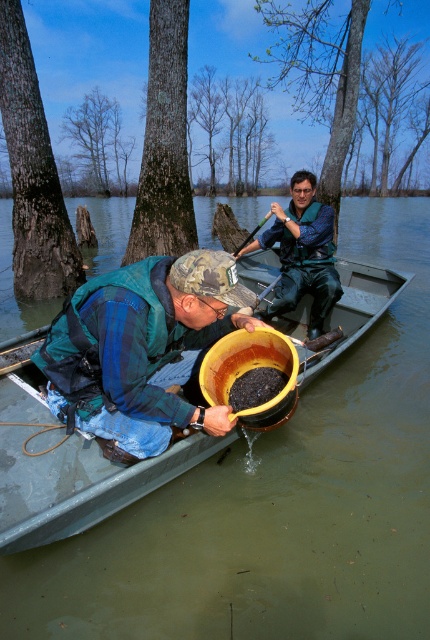
Is the position of green plastic boat at center more distant than that of blue fabric jacket at center?

No, it is not.

Identify the location of green plastic boat at center. (79, 484).

Is point (116, 504) closer to camera compared to point (307, 177)?

Yes, it is.

Identify the location of green plastic boat at center. This screenshot has height=640, width=430. (79, 484).

Does green plastic boat at center have a lesser height compared to wooden paddle at center?

Indeed, green plastic boat at center has a lesser height compared to wooden paddle at center.

Which is more to the left, green plastic boat at center or wooden paddle at center?

green plastic boat at center

The height and width of the screenshot is (640, 430). I want to click on green plastic boat at center, so click(79, 484).

Is camouflage fabric hat at center below green plastic boat at center?

Actually, camouflage fabric hat at center is above green plastic boat at center.

Who is shorter, camouflage fabric hat at center or green plastic boat at center?

With less height is green plastic boat at center.

Does point (117, 353) lie in front of point (33, 499)?

Yes, point (117, 353) is closer to viewer.

The height and width of the screenshot is (640, 430). In order to click on camouflage fabric hat at center in this screenshot , I will do `click(138, 346)`.